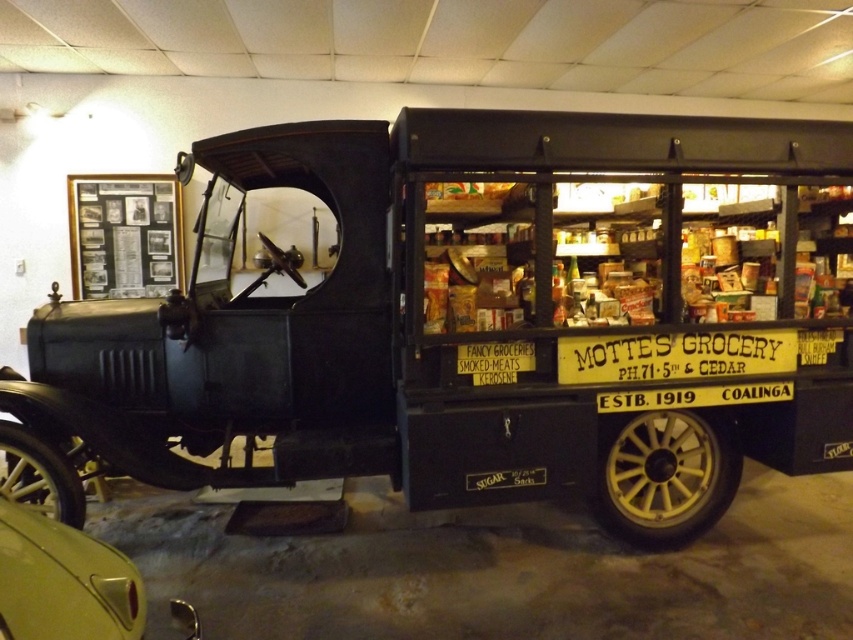
Can you confirm if matte black truck at center is positioned to the right of metallic gold car at lower left?

Indeed, matte black truck at center is positioned on the right side of metallic gold car at lower left.

Find the location of a particular element. This screenshot has height=640, width=853. matte black truck at center is located at coordinates [x=469, y=324].